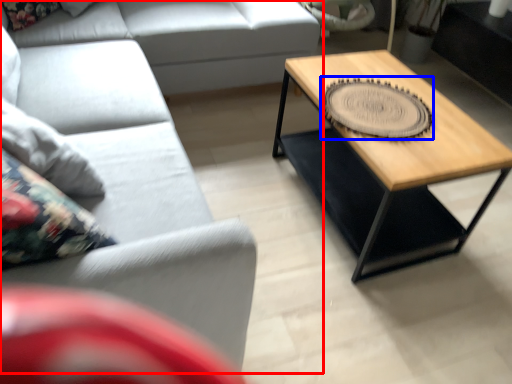
Question: Which object is further to the camera taking this photo, studio couch (highlighted by a red box) or coaster (highlighted by a blue box)?

Choices:
 (A) studio couch
 (B) coaster

Answer: (B)